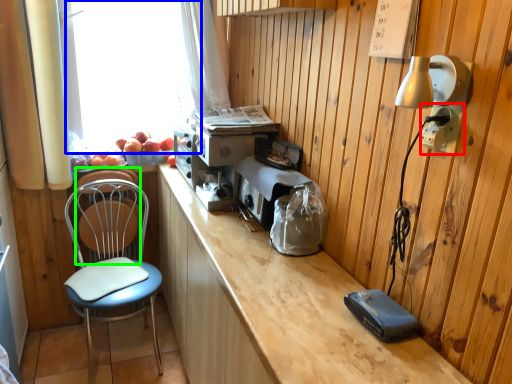
Question: Which object is the farthest from electric outlet (highlighted by a red box)? Choose among these: window screen (highlighted by a blue box) or armchair (highlighted by a green box).

Choices:
 (A) window screen
 (B) armchair

Answer: (B)